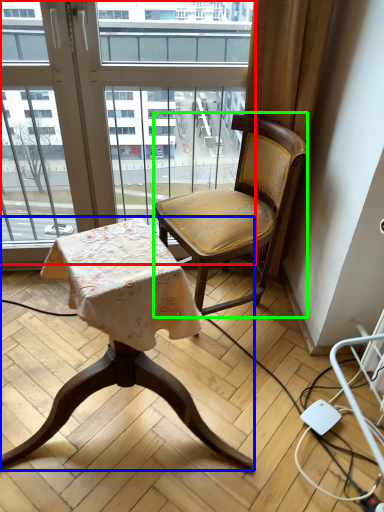
Question: Estimate the real-world distances between objects in this image. Which object is farther from window (highlighted by a red box), chair (highlighted by a blue box) or chair (highlighted by a green box)?

Choices:
 (A) chair
 (B) chair

Answer: (A)